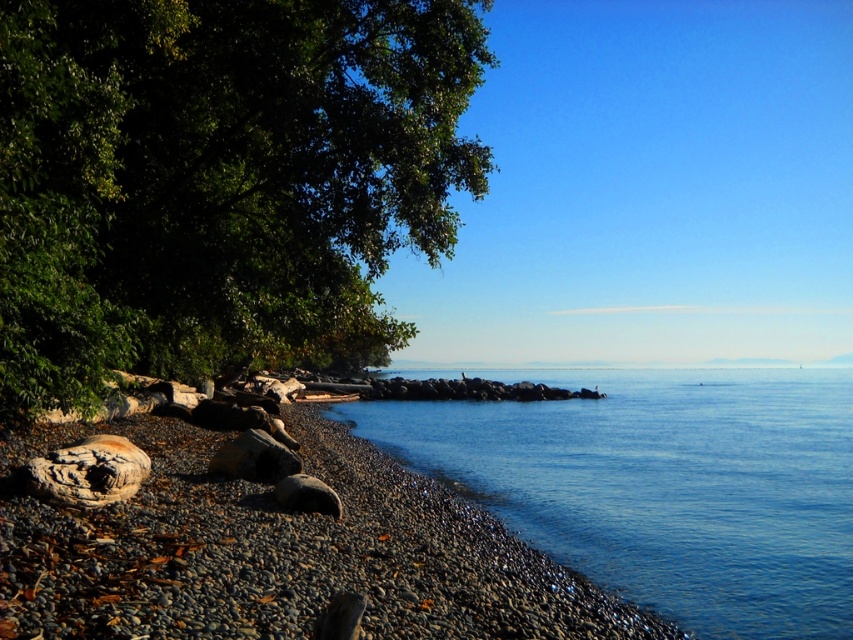
You are planning to set up a small tent for a picnic. The tent requires a flat area that is wider than the green leafy tree at left. Can the blue smooth water at center provide enough space for your tent?

The blue smooth water at center has a greater width than the green leafy tree at left, so yes, the blue smooth water at center can provide enough space for the tent.

You are standing at the point marked as point (219, 179) in the image. What object is located at that point?

The point (219, 179) indicates the location of the green leafy tree at left.